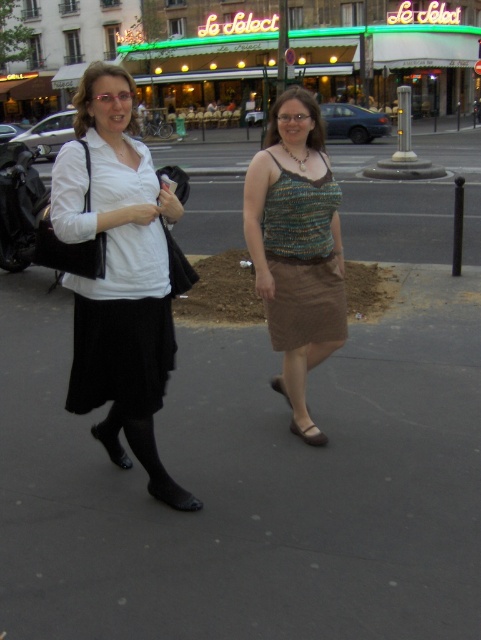
Question: Observing the image, what is the correct spatial positioning of knitted fabric tank top at center in reference to knitted fabric dress at center?

Choices:
 (A) right
 (B) left

Answer: (B)

Question: Is matte black skirt at left below knitted fabric tank top at center?

Choices:
 (A) yes
 (B) no

Answer: (B)

Question: Is matte black skirt at left further to camera compared to knitted fabric dress at center?

Choices:
 (A) no
 (B) yes

Answer: (A)

Question: Which object appears closest to the camera in this image?

Choices:
 (A) knitted fabric dress at center
 (B) knitted fabric tank top at center

Answer: (B)

Question: Which point is closer to the camera?

Choices:
 (A) (291, 308)
 (B) (101, 296)
 (C) (320, 232)

Answer: (B)

Question: Which point is closer to the camera?

Choices:
 (A) (314, 308)
 (B) (329, 218)
 (C) (77, 209)

Answer: (C)